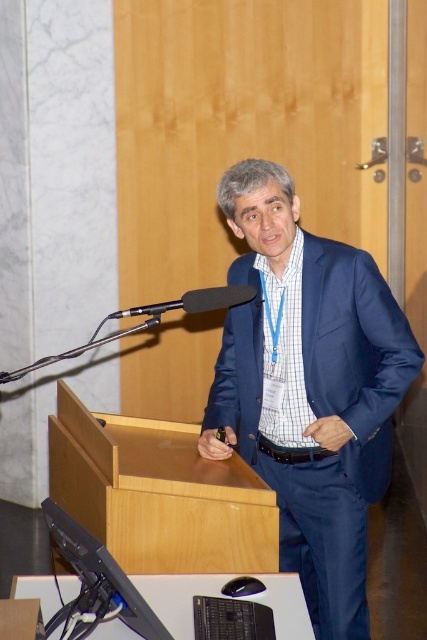
Question: Which object is closer to the camera taking this photo?

Choices:
 (A) black matte microphone at center
 (B) blue satin suit at center

Answer: (A)

Question: Can you confirm if blue satin suit at center is positioned below black matte microphone at center?

Choices:
 (A) no
 (B) yes

Answer: (B)

Question: Can you confirm if blue satin suit at center is positioned above black matte microphone at center?

Choices:
 (A) no
 (B) yes

Answer: (A)

Question: Which of the following is the closest to the observer?

Choices:
 (A) (172, 307)
 (B) (249, 385)

Answer: (A)

Question: Is blue satin suit at center positioned behind black matte microphone at center?

Choices:
 (A) yes
 (B) no

Answer: (A)

Question: Among these points, which one is farthest from the camera?

Choices:
 (A) (246, 420)
 (B) (205, 305)

Answer: (A)